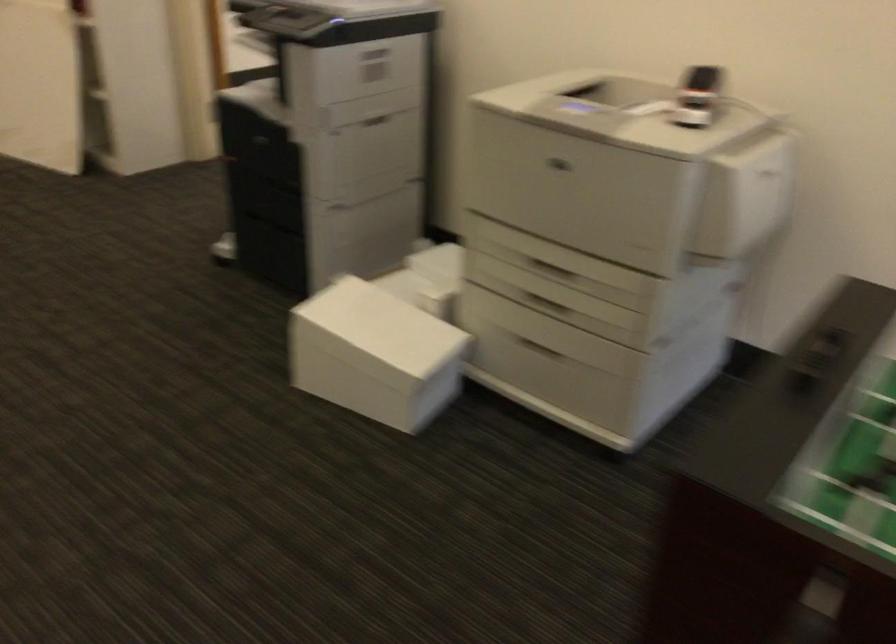
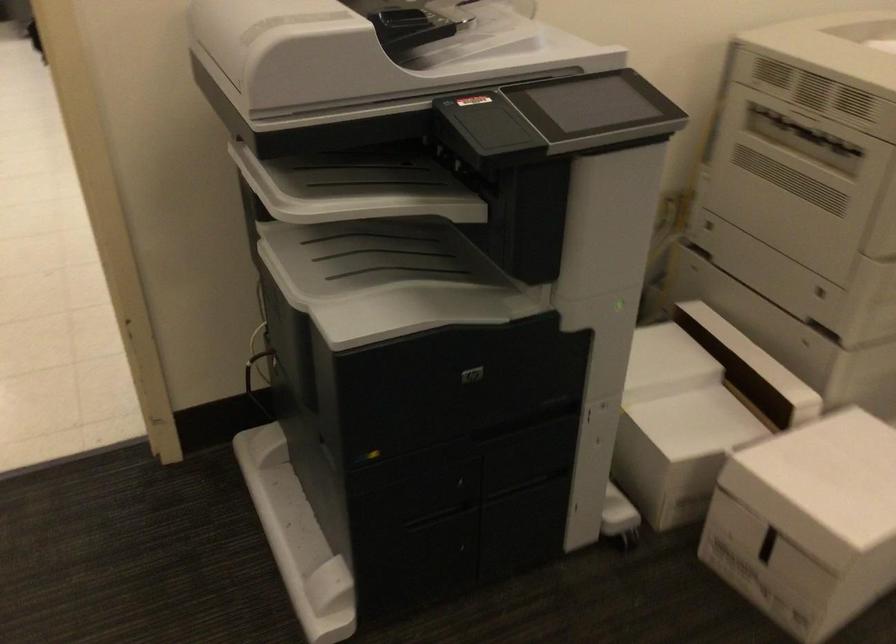
The point at (349, 307) is marked in the first image. Where is the corresponding point in the second image?

(822, 484)